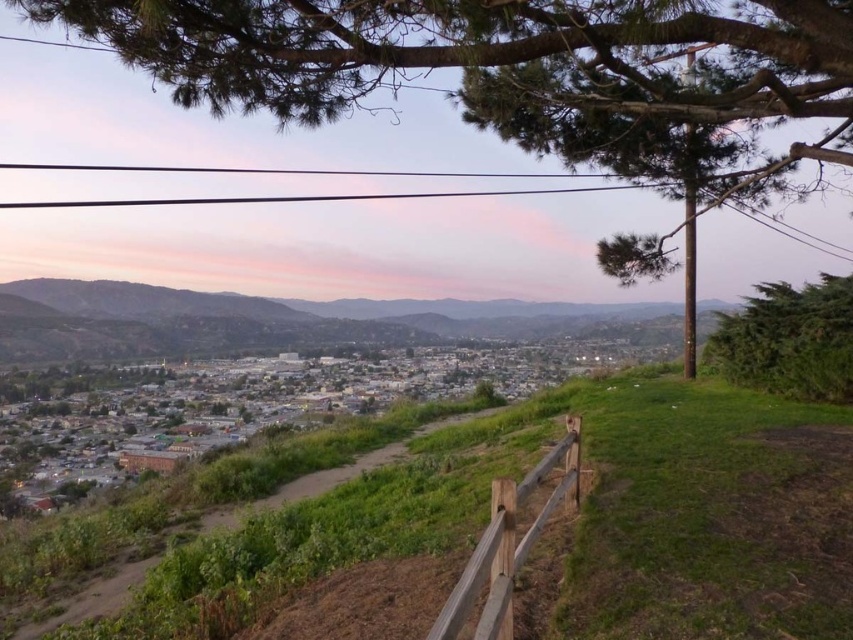
Who is positioned more to the left, green leafy tree at upper center or brown wooden fence at lower right?

From the viewer's perspective, brown wooden fence at lower right appears more on the left side.

Is point (648, 250) positioned before point (508, 496)?

No, (648, 250) is behind (508, 496).

Image resolution: width=853 pixels, height=640 pixels. Identify the location of green leafy tree at upper center. (527, 81).

Which is behind, point (321, 323) or point (830, 285)?

Positioned behind is point (321, 323).

Between green grassy hillside at center and green leafy bush at right, which one has more height?

With more height is green grassy hillside at center.

The height and width of the screenshot is (640, 853). I want to click on green grassy hillside at center, so click(x=328, y=317).

Is green leafy bush at right thinner than brown wooden fence at lower right?

No.

Between green leafy bush at right and brown wooden fence at lower right, which one is positioned lower?

brown wooden fence at lower right

The width and height of the screenshot is (853, 640). Describe the element at coordinates (788, 340) in the screenshot. I see `green leafy bush at right` at that location.

The image size is (853, 640). What are the coordinates of `green leafy bush at right` in the screenshot? It's located at (788, 340).